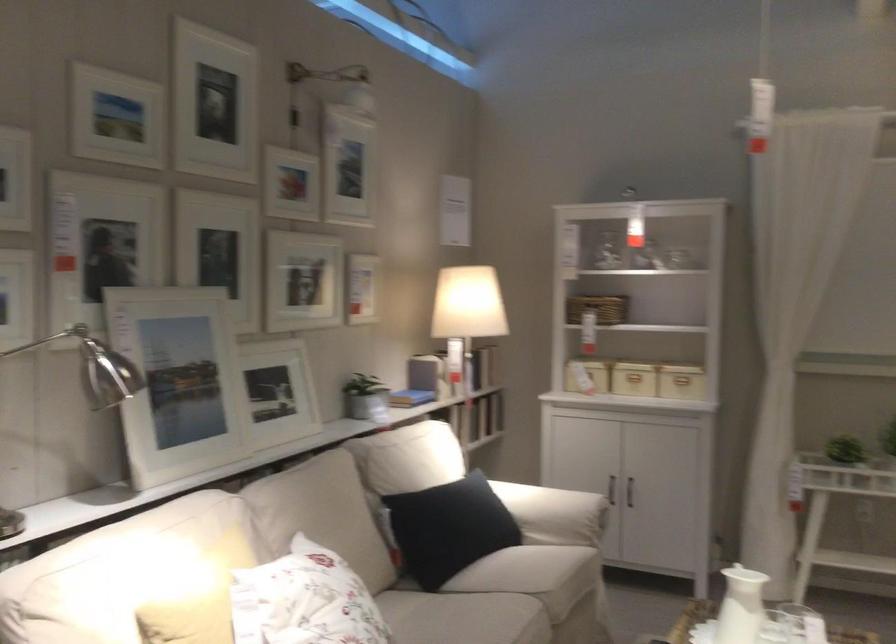
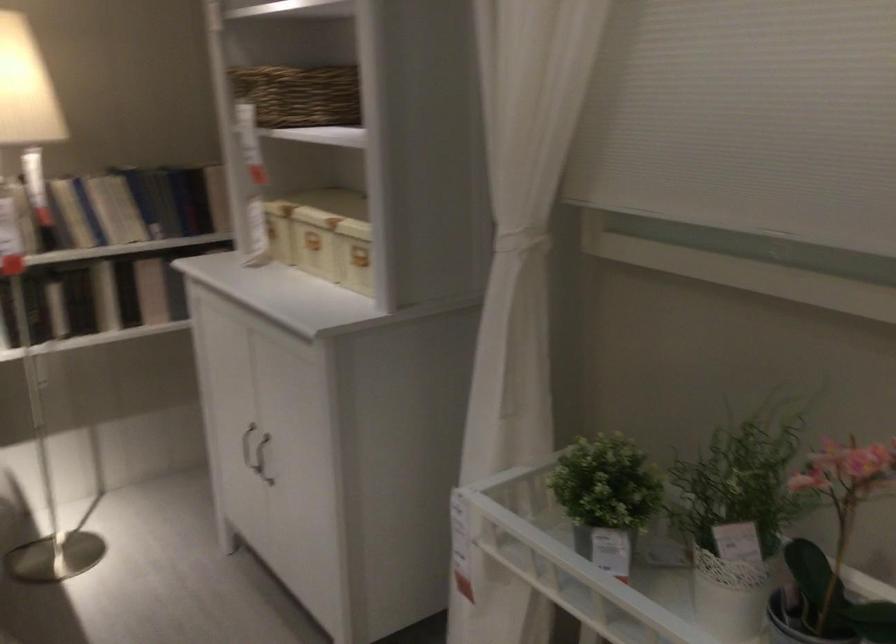
The point at (601, 365) is marked in the first image. Where is the corresponding point in the second image?

(270, 230)